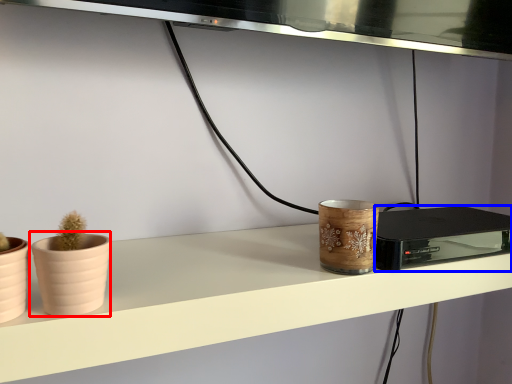
Question: Which object appears closest to the camera in this image, flowerpot (highlighted by a red box) or appliance (highlighted by a blue box)?

Choices:
 (A) flowerpot
 (B) appliance

Answer: (A)